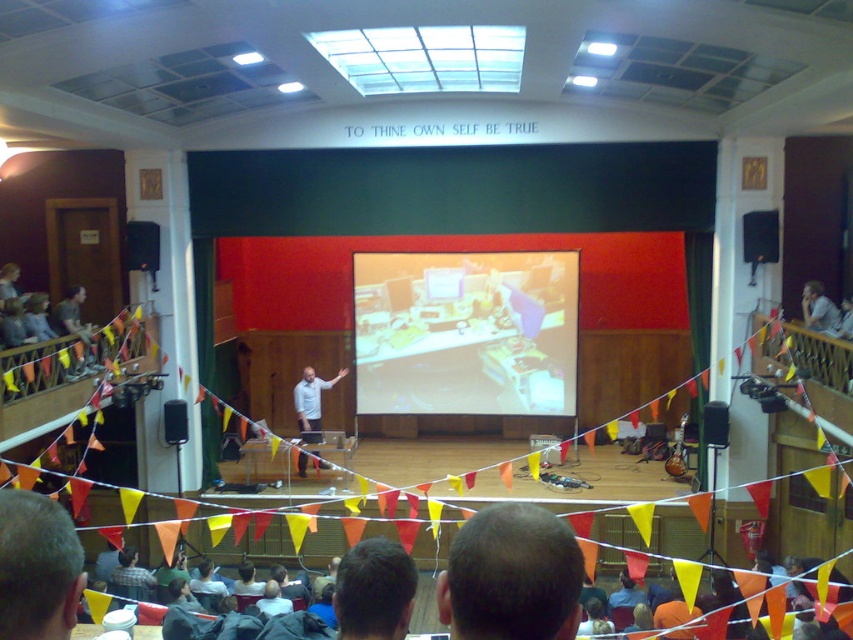
Is matte yellow projector screen at center to the left of light blue shirt at center from the viewer's perspective?

In fact, matte yellow projector screen at center is to the right of light blue shirt at center.

Can you confirm if matte yellow projector screen at center is bigger than light blue shirt at center?

Indeed, matte yellow projector screen at center has a larger size compared to light blue shirt at center.

I want to click on matte yellow projector screen at center, so click(x=465, y=332).

Does light blue shirt at center appear on the left side of black plastic speaker at upper right?

Correct, you'll find light blue shirt at center to the left of black plastic speaker at upper right.

Locate an element on the screen. The image size is (853, 640). light blue shirt at center is located at coordinates (311, 403).

At what (x,y) coordinates should I click in order to perform the action: click on light blue shirt at center. Please return your answer as a coordinate pair (x, y). This screenshot has width=853, height=640. Looking at the image, I should click on (311, 403).

The width and height of the screenshot is (853, 640). Find the location of `light blue shirt at center`. light blue shirt at center is located at coordinates (311, 403).

Does matte yellow projector screen at center appear over black plastic speaker at left?

Actually, matte yellow projector screen at center is below black plastic speaker at left.

In the scene shown: Can you confirm if matte yellow projector screen at center is smaller than black plastic speaker at left?

No.

Who is more distant from viewer, (440, 333) or (149, 257)?

→ Positioned behind is point (440, 333).

The width and height of the screenshot is (853, 640). Find the location of `matte yellow projector screen at center`. matte yellow projector screen at center is located at coordinates (465, 332).